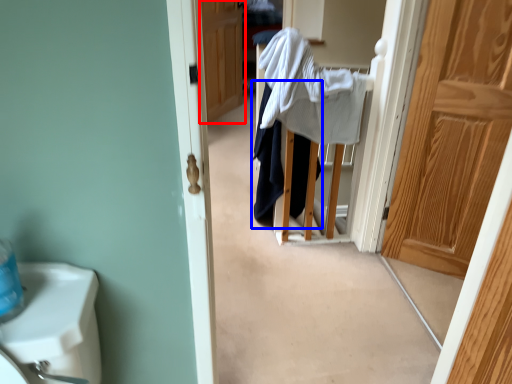
Question: Which object is closer to the camera taking this photo, door (highlighted by a red box) or clothing (highlighted by a blue box)?

Choices:
 (A) door
 (B) clothing

Answer: (B)